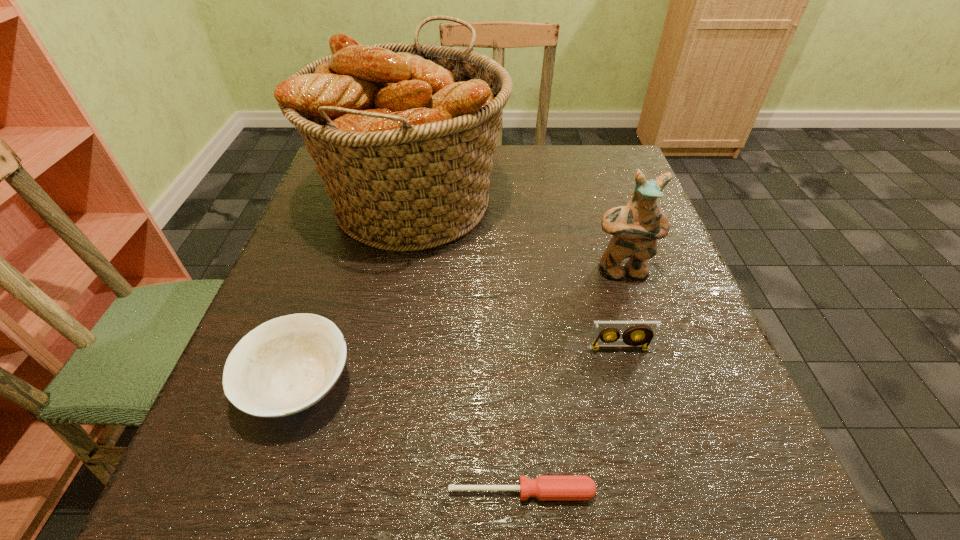
The image size is (960, 540). I want to click on the tallest object, so click(403, 135).

The width and height of the screenshot is (960, 540). I want to click on figurine, so pyautogui.click(x=636, y=227).

Locate an element on the screen. This screenshot has height=540, width=960. bowl is located at coordinates (287, 364).

Where is `videotape`? This screenshot has height=540, width=960. videotape is located at coordinates (646, 330).

Find the location of a particular element. the nearest object is located at coordinates (543, 487).

The width and height of the screenshot is (960, 540). I want to click on the shortest object, so click(543, 487).

You are a GUI agent. You are given a task and a screenshot of the screen. Output one action in this format:
    pyautogui.click(x=<x>, y=<y>)
    Task: Click on the free space located on the right of the tallest object
    
    Given the screenshot: What is the action you would take?
    tap(603, 204)

Locate an element on the screen. The width and height of the screenshot is (960, 540). blank area located on the front-facing side of the fourth shortest object is located at coordinates (678, 446).

At what (x,y) coordinates should I click in order to perform the action: click on free spot located on the right of the bowl. Please return your answer as a coordinate pair (x, y). The image size is (960, 540). Looking at the image, I should click on (566, 385).

Image resolution: width=960 pixels, height=540 pixels. What are the coordinates of `vacant area situated at the front of the videotape with visible reels` in the screenshot? It's located at (638, 422).